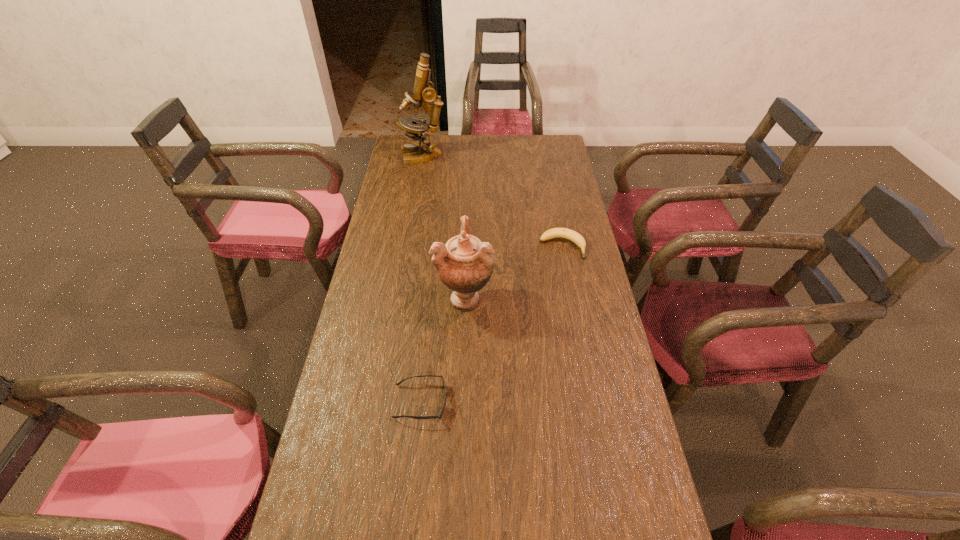
You are a GUI agent. You are given a task and a screenshot of the screen. Output one action in this format:
    pyautogui.click(x=<x>, y=<y>)
    Task: Click on the object that stands as the closest to the sunglasses
    The image size is (960, 540).
    Given the screenshot: What is the action you would take?
    tap(464, 264)

Where is `the closest object relative to the nearest object`? This screenshot has height=540, width=960. the closest object relative to the nearest object is located at coordinates (464, 264).

What are the coordinates of `vacant space that satisfies the following two spatial constraints: 1. on the front side of the rightmost object; 2. on the front-facing side of the nearest object` in the screenshot? It's located at (592, 402).

Locate an element on the screen. This screenshot has width=960, height=540. vacant space that satisfies the following two spatial constraints: 1. on the front side of the third farthest object; 2. on the front-facing side of the sunglasses is located at coordinates (462, 402).

You are a GUI agent. You are given a task and a screenshot of the screen. Output one action in this format:
    pyautogui.click(x=<x>, y=<y>)
    Task: Click on the vacant space that satisfies the following two spatial constraints: 1. on the front side of the third nearest object; 2. on the front-facing side of the sunglasses
    
    Given the screenshot: What is the action you would take?
    pyautogui.click(x=592, y=402)

This screenshot has height=540, width=960. Identify the location of free spot that satisfies the following two spatial constraints: 1. on the front side of the tallest object; 2. on the left side of the banana. (408, 247).